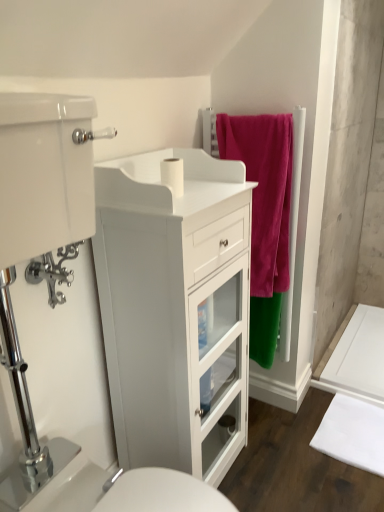
Question: From a real-world perspective, is white glossy sink at lower center located beneath white matte toilet paper at center?

Choices:
 (A) yes
 (B) no

Answer: (A)

Question: From the image's perspective, does white glossy sink at lower center appear lower than white matte toilet paper at center?

Choices:
 (A) no
 (B) yes

Answer: (B)

Question: Could you tell me if white glossy sink at lower center is facing white matte toilet paper at center?

Choices:
 (A) yes
 (B) no

Answer: (B)

Question: Can you confirm if white glossy sink at lower center is taller than white matte toilet paper at center?

Choices:
 (A) no
 (B) yes

Answer: (B)

Question: From a real-world perspective, is white glossy sink at lower center over white matte toilet paper at center?

Choices:
 (A) yes
 (B) no

Answer: (B)

Question: Does white glossy sink at lower center come in front of white matte toilet paper at center?

Choices:
 (A) no
 (B) yes

Answer: (B)

Question: Considering the relative sizes of white glossy cabinet at left and white fabric bath mat at lower right in the image provided, is white glossy cabinet at left taller than white fabric bath mat at lower right?

Choices:
 (A) yes
 (B) no

Answer: (A)

Question: Can you see white glossy cabinet at left touching white fabric bath mat at lower right?

Choices:
 (A) yes
 (B) no

Answer: (B)

Question: Is white glossy cabinet at left in front of white fabric bath mat at lower right?

Choices:
 (A) yes
 (B) no

Answer: (A)

Question: Would you say white glossy cabinet at left is outside white fabric bath mat at lower right?

Choices:
 (A) yes
 (B) no

Answer: (A)

Question: Is white glossy cabinet at left at the right side of white fabric bath mat at lower right?

Choices:
 (A) no
 (B) yes

Answer: (A)

Question: Can white fabric bath mat at lower right be found inside white glossy cabinet at left?

Choices:
 (A) no
 (B) yes

Answer: (A)

Question: Does white glossy sink at lower center appear on the right side of velvet pink towel at upper right?

Choices:
 (A) yes
 (B) no

Answer: (B)